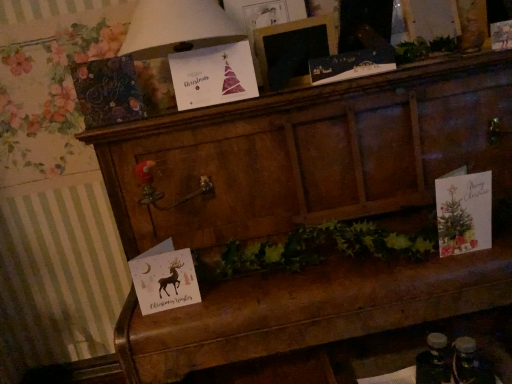
Question: Which direction should I rotate to look at matte black card at upper center, the first christmas card from the top?

Choices:
 (A) left
 (B) right

Answer: (B)

Question: Is wooden chest at center outside of matte paper card at right, which is counted as the fourth christmas card, starting from the left?

Choices:
 (A) no
 (B) yes

Answer: (B)

Question: Does wooden chest at center have a larger size compared to matte paper card at right, positioned as the 3th christmas card in top-to-bottom order?

Choices:
 (A) yes
 (B) no

Answer: (A)

Question: Does wooden chest at center have a greater width compared to matte paper card at right, positioned as the 3th christmas card in top-to-bottom order?

Choices:
 (A) no
 (B) yes

Answer: (B)

Question: Is wooden chest at center placed right next to matte paper card at right, the second christmas card in the bottom-to-top sequence?

Choices:
 (A) no
 (B) yes

Answer: (A)

Question: Does wooden chest at center lie behind matte paper card at right, which is counted as the fourth christmas card, starting from the left?

Choices:
 (A) no
 (B) yes

Answer: (A)

Question: Considering the relative sizes of wooden chest at center and matte paper card at right, the first christmas card from the right, in the image provided, is wooden chest at center taller than matte paper card at right, the first christmas card from the right,?

Choices:
 (A) yes
 (B) no

Answer: (A)

Question: Is white paper christmas card at upper center bigger than watercolor paper christmas card at upper center, arranged as the 2th christmas card when viewed from the left?

Choices:
 (A) yes
 (B) no

Answer: (A)

Question: Is white paper christmas card at upper center facing away from watercolor paper christmas card at upper center, arranged as the second christmas card when viewed from the top?

Choices:
 (A) no
 (B) yes

Answer: (A)

Question: Is white paper christmas card at upper center smaller than watercolor paper christmas card at upper center, acting as the 3th christmas card starting from the bottom?

Choices:
 (A) no
 (B) yes

Answer: (A)

Question: From the image's perspective, is white paper christmas card at upper center over watercolor paper christmas card at upper center, arranged as the 2th christmas card when viewed from the left?

Choices:
 (A) no
 (B) yes

Answer: (B)

Question: Considering the relative sizes of white paper christmas card at upper center and watercolor paper christmas card at upper center, arranged as the second christmas card when viewed from the top, in the image provided, is white paper christmas card at upper center shorter than watercolor paper christmas card at upper center, arranged as the second christmas card when viewed from the top,?

Choices:
 (A) no
 (B) yes

Answer: (A)

Question: Considering the relative positions of white paper christmas card at upper center and watercolor paper christmas card at upper center, arranged as the 2th christmas card when viewed from the left, in the image provided, is white paper christmas card at upper center behind watercolor paper christmas card at upper center, arranged as the 2th christmas card when viewed from the left,?

Choices:
 (A) no
 (B) yes

Answer: (A)

Question: From the image's perspective, is wooden picture frame at upper center on white paper christmas card at upper center?

Choices:
 (A) no
 (B) yes

Answer: (B)